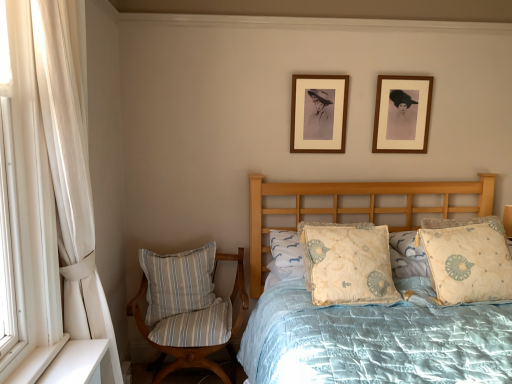
Question: Considering the relative sizes of striped fabric pillow at lower left, which appears as the 4th pillow when viewed from the right, and light beige fabric pillow at center, which is the 2th pillow in left-to-right order, in the image provided, is striped fabric pillow at lower left, which appears as the 4th pillow when viewed from the right, thinner than light beige fabric pillow at center, which is the 2th pillow in left-to-right order,?

Choices:
 (A) no
 (B) yes

Answer: (B)

Question: From the image's perspective, does striped fabric pillow at lower left, which appears as the 4th pillow when viewed from the right, appear higher than light beige fabric pillow at center, which is the 2th pillow in left-to-right order?

Choices:
 (A) no
 (B) yes

Answer: (A)

Question: Does striped fabric pillow at lower left, which is the 1th pillow in left-to-right order, have a greater height compared to light beige fabric pillow at center, the third pillow positioned from the right?

Choices:
 (A) no
 (B) yes

Answer: (B)

Question: From a real-world perspective, does striped fabric pillow at lower left, which appears as the 4th pillow when viewed from the right, stand above light beige fabric pillow at center, the third pillow positioned from the right?

Choices:
 (A) no
 (B) yes

Answer: (A)

Question: Can you confirm if striped fabric pillow at lower left, which is the 1th pillow in left-to-right order, is positioned to the left of light beige fabric pillow at center, which is the 2th pillow in left-to-right order?

Choices:
 (A) yes
 (B) no

Answer: (A)

Question: Do you think white fabric curtain at left is within beige floral pillow at right, which is the 1th pillow in right-to-left order, or outside of it?

Choices:
 (A) inside
 (B) outside

Answer: (B)

Question: Based on their positions, is white fabric curtain at left located to the left or right of beige floral pillow at right, which is the 1th pillow in right-to-left order?

Choices:
 (A) left
 (B) right

Answer: (A)

Question: Based on their sizes in the image, would you say white fabric curtain at left is bigger or smaller than beige floral pillow at right, which is the 1th pillow in right-to-left order?

Choices:
 (A) small
 (B) big

Answer: (B)

Question: In the image, is white fabric curtain at left positioned in front of or behind beige floral pillow at right, positioned as the fourth pillow in left-to-right order?

Choices:
 (A) behind
 (B) front

Answer: (B)

Question: Is matte brown picture frame at upper center, the second picture frame from the right, taller or shorter than light beige fabric pillow at center, which is the 2th pillow in left-to-right order?

Choices:
 (A) tall
 (B) short

Answer: (A)

Question: Based on their sizes in the image, would you say matte brown picture frame at upper center, the second picture frame from the right, is bigger or smaller than light beige fabric pillow at center, which is the 2th pillow in left-to-right order?

Choices:
 (A) big
 (B) small

Answer: (B)

Question: In the image, is matte brown picture frame at upper center, the second picture frame from the right, positioned in front of or behind light beige fabric pillow at center, which is the 2th pillow in left-to-right order?

Choices:
 (A) behind
 (B) front

Answer: (A)

Question: Which is correct: matte brown picture frame at upper center, which is the first picture frame from left to right, is inside light beige fabric pillow at center, which is the 2th pillow in left-to-right order, or outside of it?

Choices:
 (A) outside
 (B) inside

Answer: (A)

Question: From the image's perspective, relative to light beige fabric pillow at center, acting as the 3th pillow starting from the left, is white fabric curtain at left above or below?

Choices:
 (A) below
 (B) above

Answer: (B)

Question: Is point (68, 28) positioned closer to the camera than point (318, 240)?

Choices:
 (A) farther
 (B) closer

Answer: (B)